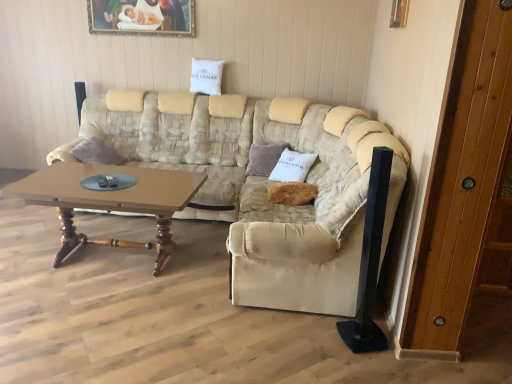
Question: Is wooden door at right taller or shorter than velvet purple pillow at center, the 2th pillow positioned from the left?

Choices:
 (A) short
 (B) tall

Answer: (B)

Question: Do you think wooden door at right is within velvet purple pillow at center, the second pillow in the front-to-back sequence, or outside of it?

Choices:
 (A) outside
 (B) inside

Answer: (A)

Question: Which of these objects is positioned farthest from the metallic gold picture frame at upper right, which is counted as the 1th picture frame, starting from the front?

Choices:
 (A) wooden door at right
 (B) velvet purple pillow at center, acting as the 2th pillow starting from the back
 (C) wooden painted picture frame at upper center, placed as the 1th picture frame when sorted from left to right
 (D) brown wooden coffee table at center
 (E) fuzzy brown pillow at center, the 1th pillow viewed from the front

Answer: (C)

Question: Based on their relative distances, which object is farther from the beige fabric couch at center?

Choices:
 (A) beige fabric armchair at center
 (B) white fabric pillow at upper center, the 3th pillow positioned from the right
 (C) wooden door at right
 (D) wooden painted picture frame at upper center, which is the 1th picture frame in top-to-bottom order
 (E) velvet purple pillow at center, the second pillow from the bottom

Answer: (D)